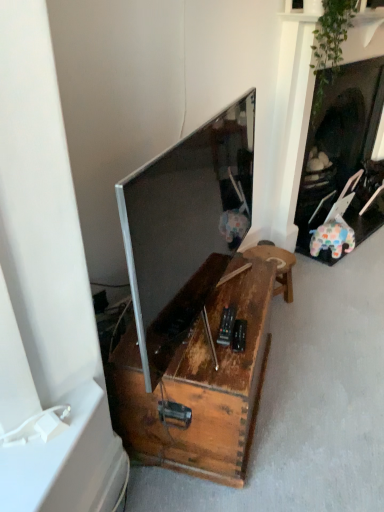
Question: Considering the relative positions of satin silver television at center and rustic wood stool at lower center in the image provided, is satin silver television at center to the right of rustic wood stool at lower center from the viewer's perspective?

Choices:
 (A) yes
 (B) no

Answer: (B)

Question: Is rustic wood stool at lower center at the back of satin silver television at center?

Choices:
 (A) yes
 (B) no

Answer: (B)

Question: Can we say satin silver television at center lies outside rustic wood stool at lower center?

Choices:
 (A) yes
 (B) no

Answer: (A)

Question: Considering the relative sizes of satin silver television at center and rustic wood stool at lower center in the image provided, is satin silver television at center shorter than rustic wood stool at lower center?

Choices:
 (A) no
 (B) yes

Answer: (A)

Question: From the image's perspective, does satin silver television at center appear lower than rustic wood stool at lower center?

Choices:
 (A) no
 (B) yes

Answer: (A)

Question: Is point (279, 292) closer or farther from the camera than point (187, 284)?

Choices:
 (A) closer
 (B) farther

Answer: (B)

Question: Is rustic wood stool at lower center in front of or behind satin silver television at center in the image?

Choices:
 (A) behind
 (B) front

Answer: (A)

Question: From a real-world perspective, relative to satin silver television at center, is rustic wood stool at lower center vertically above or below?

Choices:
 (A) below
 (B) above

Answer: (A)

Question: From the image's perspective, is rustic wood stool at lower center located above or below satin silver television at center?

Choices:
 (A) above
 (B) below

Answer: (B)

Question: From a real-world perspective, relative to rusty wood table at center, is satin silver television at center vertically above or below?

Choices:
 (A) below
 (B) above

Answer: (B)

Question: Considering their positions, is satin silver television at center located in front of or behind rusty wood table at center?

Choices:
 (A) behind
 (B) front

Answer: (B)

Question: Considering the positions of point (132, 192) and point (153, 384), is point (132, 192) closer or farther from the camera than point (153, 384)?

Choices:
 (A) closer
 (B) farther

Answer: (A)

Question: Do you think satin silver television at center is within rusty wood table at center, or outside of it?

Choices:
 (A) inside
 (B) outside

Answer: (B)

Question: From a real-world perspective, relative to rustic wood stool at lower center, is satin silver television at center vertically above or below?

Choices:
 (A) below
 (B) above

Answer: (B)

Question: Is satin silver television at center wider or thinner than rustic wood stool at lower center?

Choices:
 (A) wide
 (B) thin

Answer: (B)